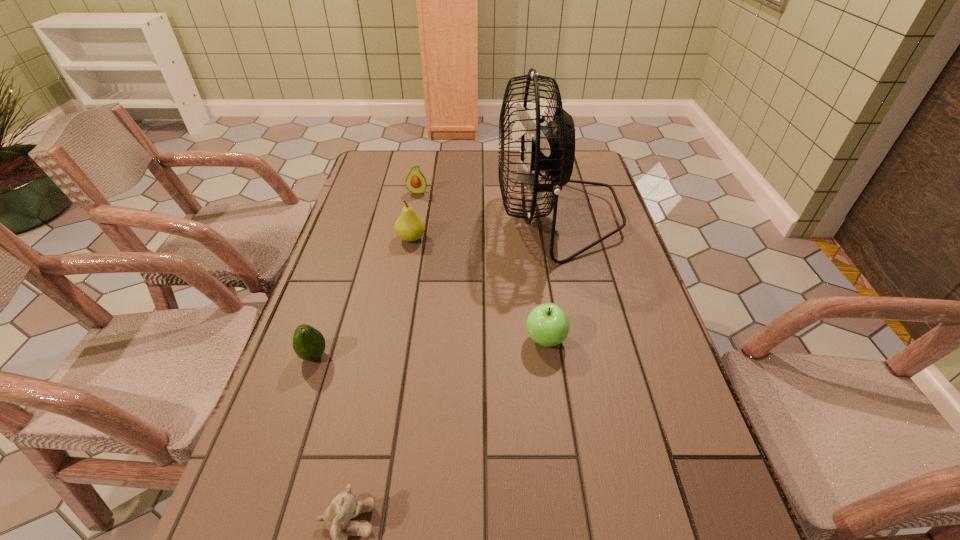
The height and width of the screenshot is (540, 960). Find the location of `vacant area located on the cut side of the right avocado`. vacant area located on the cut side of the right avocado is located at coordinates (408, 241).

Find the location of `vacant space located 0.400m on the left of the apple`. vacant space located 0.400m on the left of the apple is located at coordinates (342, 340).

Identify the location of vacant space located on the back of the left avocado. (351, 245).

Image resolution: width=960 pixels, height=540 pixels. Identify the location of object located in the far edge section of the desktop. (551, 148).

Where is `object located in the left edge section of the desktop`? object located in the left edge section of the desktop is located at coordinates (308, 343).

The width and height of the screenshot is (960, 540). Find the location of `object situated at the right edge`. object situated at the right edge is located at coordinates (551, 148).

At what (x,y) coordinates should I click in order to perform the action: click on object located at the far right corner. Please return your answer as a coordinate pair (x, y). The image size is (960, 540). Looking at the image, I should click on (551, 148).

In the image, there is a desktop. Where is `blank space at the far edge`? The image size is (960, 540). blank space at the far edge is located at coordinates (445, 152).

Find the location of a particular element. The width and height of the screenshot is (960, 540). vacant space at the left edge of the desktop is located at coordinates (366, 247).

The width and height of the screenshot is (960, 540). I want to click on vacant area at the right edge, so click(652, 471).